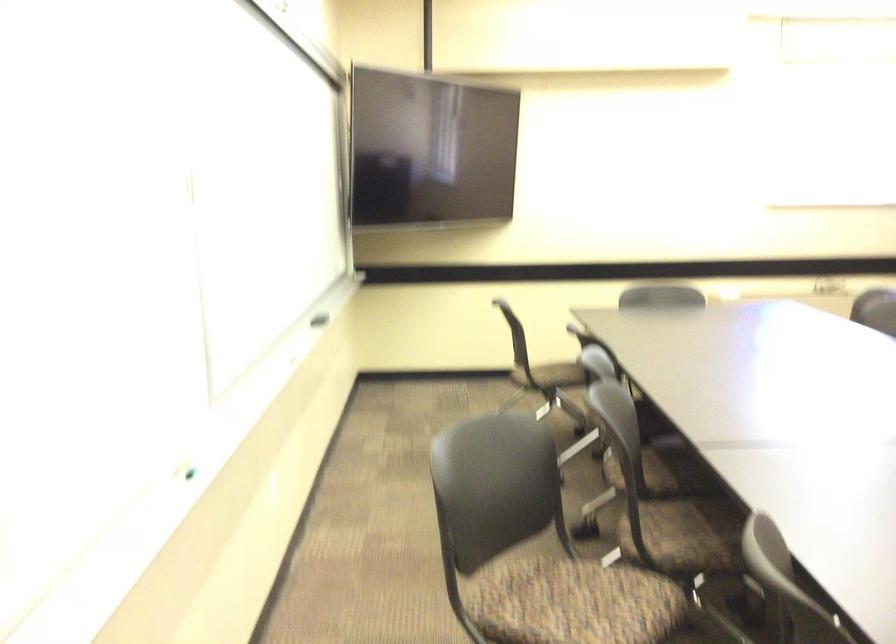
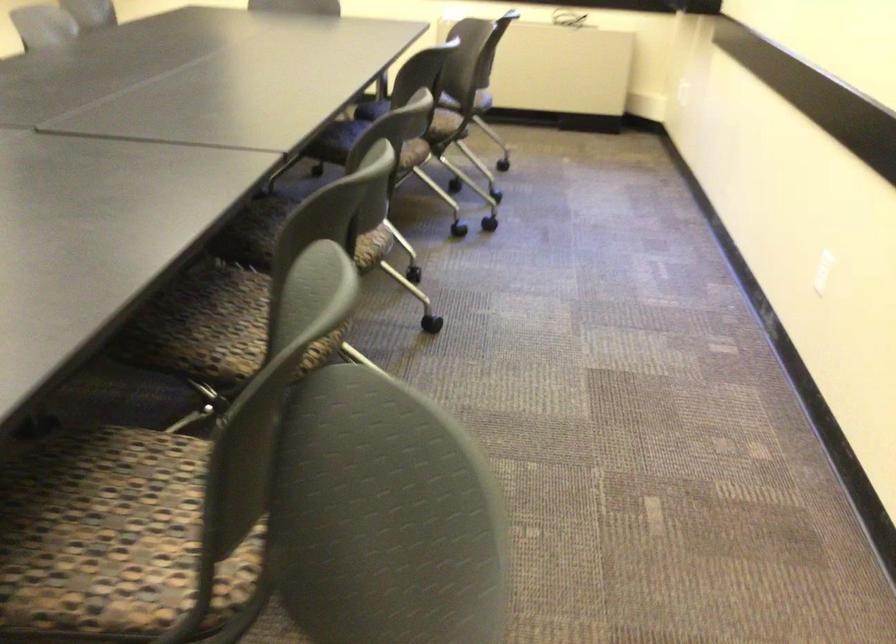
Question: What movement of the cameraman would produce the second image?

Choices:
 (A) Left
 (B) Right
 (C) Forward
 (D) Backward

Answer: (B)